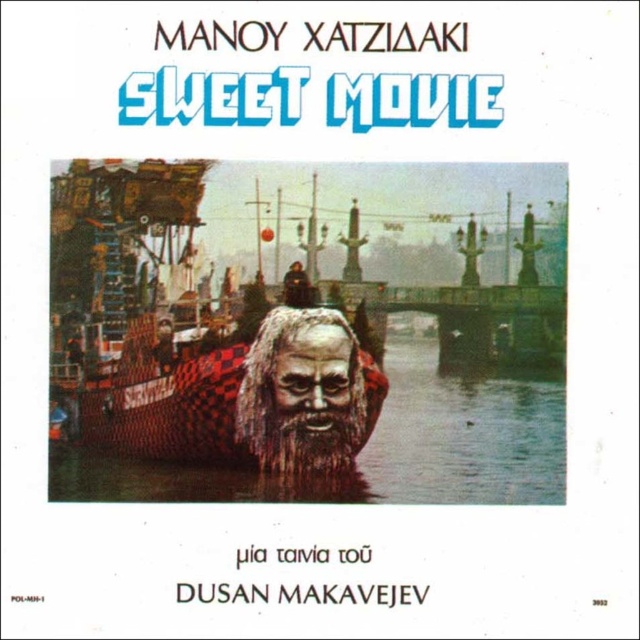
You are an art critic analyzing the poster for Sweet Movie. You notice two central elements, the grayish textured mask at center and the brown textured face at center. Which of these elements is closer to the viewer?

The grayish textured mask at center is closer to the viewer than the brown textured face at center.

Based on the movie poster description provided, which object, the metallic water at center or the grayish textured mask at center, occupies a larger vertical space in the image?

The grayish textured mask at center is taller than the metallic water at center, so it occupies a larger vertical space.

You are a photographer taking a picture of the movie poster. You notice two points on the poster at coordinates point (388, 403) and point (268, 364). Which point is closer to the camera?

Point (268, 364) is closer to the camera than point (388, 403).